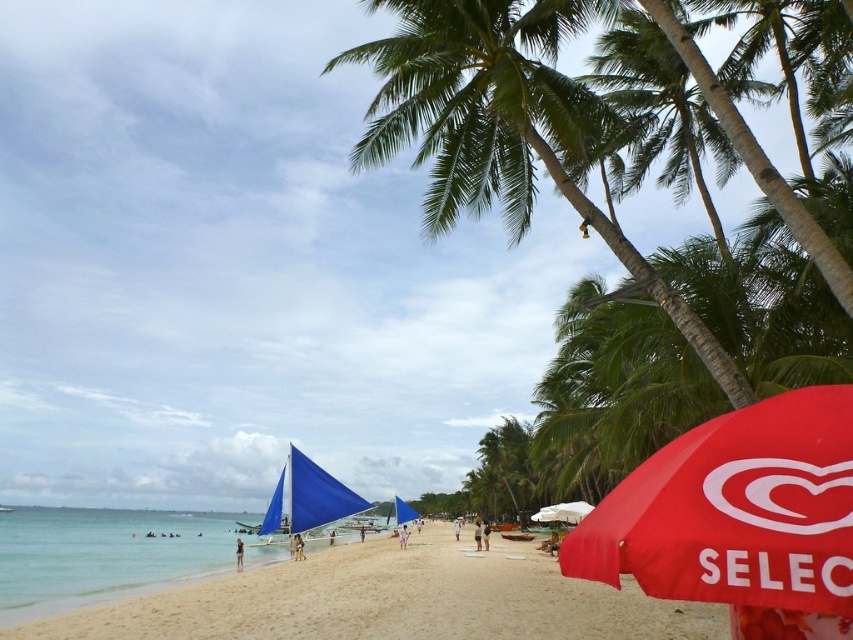
Based on the photo, is the position of beige sandy beach at lower center less distant than that of red fabric umbrella at lower right?

No, it is not.

Who is positioned more to the right, beige sandy beach at lower center or red fabric umbrella at lower right?

From the viewer's perspective, red fabric umbrella at lower right appears more on the right side.

Find the location of a particular element. This screenshot has height=640, width=853. beige sandy beach at lower center is located at coordinates (390, 600).